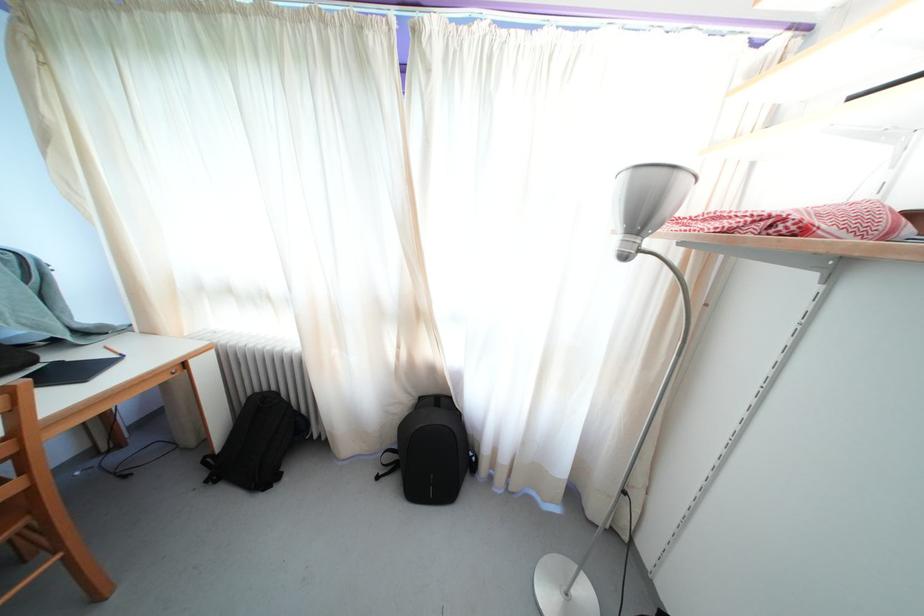
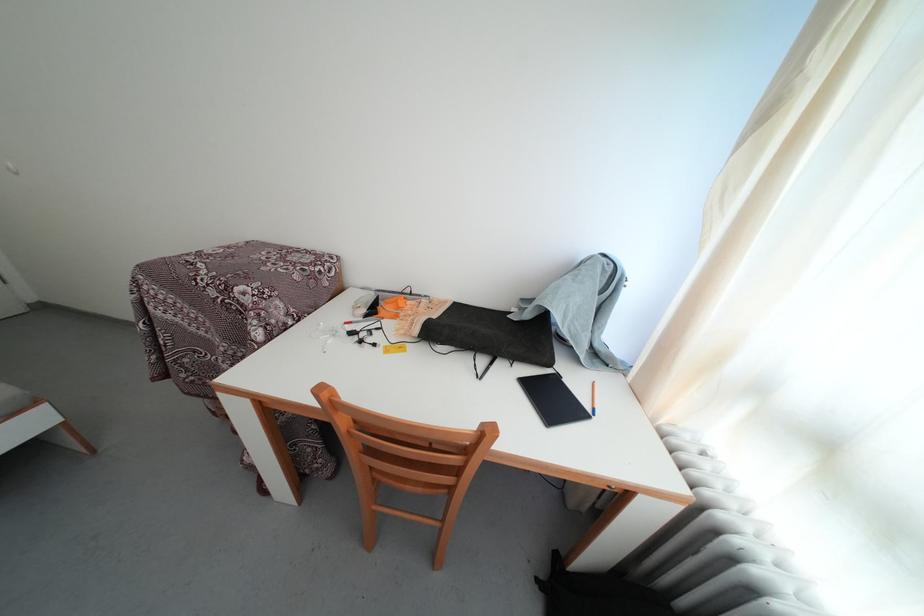
Based on the continuous images, in which direction is the camera rotating?

The camera's rotation is toward left-down.